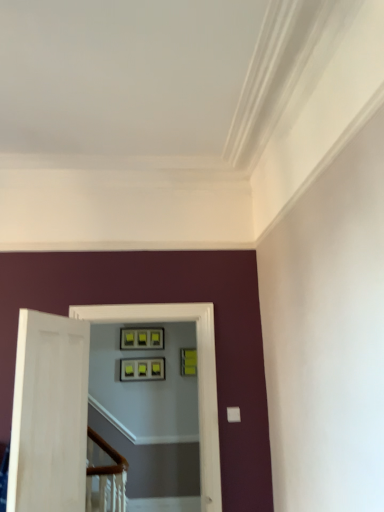
The width and height of the screenshot is (384, 512). In order to click on matte black picture frame at center, which is the 1th picture frame in left-to-right order in this screenshot , I will do `click(142, 369)`.

The width and height of the screenshot is (384, 512). What do you see at coordinates (198, 375) in the screenshot?
I see `matte black frames at center` at bounding box center [198, 375].

At what (x,y) coordinates should I click in order to perform the action: click on green matte picture frame at upper center, which is the 2th picture frame from left to right. Please return your answer as a coordinate pair (x, y). Image resolution: width=384 pixels, height=512 pixels. Looking at the image, I should click on (188, 362).

From the image's perspective, is green matte picture frame at upper center, which is the 2th picture frame from left to right, below matte black frames at center?

Indeed, from the image's perspective, green matte picture frame at upper center, which is the 2th picture frame from left to right, is shown beneath matte black frames at center.

This screenshot has width=384, height=512. In order to click on passage lying on the left of green matte picture frame at upper center, which is the 2th picture frame from left to right in this screenshot , I will do `click(198, 375)`.

Does point (182, 362) lie in front of point (75, 308)?

No, (182, 362) is behind (75, 308).

Is matte black picture frame at center, which is the second picture frame from right to left, far from matte black frames at center?

Yes, matte black picture frame at center, which is the second picture frame from right to left, and matte black frames at center are located far from each other.

From a real-world perspective, is matte black picture frame at center, which is the second picture frame from right to left, over matte black frames at center?

Yes, from a real-world perspective, matte black picture frame at center, which is the second picture frame from right to left, is over matte black frames at center

Is matte black picture frame at center, which is the second picture frame from right to left, in front of matte black frames at center?

No, the depth of matte black picture frame at center, which is the second picture frame from right to left, is greater than that of matte black frames at center.

Based on their sizes in the image, would you say matte black picture frame at center, which is the second picture frame from right to left, is bigger or smaller than matte black frames at center?

matte black picture frame at center, which is the second picture frame from right to left, is smaller than matte black frames at center.

Considering the relative sizes of matte black frames at center and green matte picture frame at upper center, the 1th picture frame positioned from the right, in the image provided, is matte black frames at center wider than green matte picture frame at upper center, the 1th picture frame positioned from the right,?

Yes, matte black frames at center is wider than green matte picture frame at upper center, the 1th picture frame positioned from the right.

Can you tell me how much matte black frames at center and green matte picture frame at upper center, which is the 2th picture frame from left to right, differ in facing direction?

The angular difference between matte black frames at center and green matte picture frame at upper center, which is the 2th picture frame from left to right, is 5.85 degrees.

Is green matte picture frame at upper center, the 1th picture frame positioned from the right, a part of matte black frames at center?

No.

The width and height of the screenshot is (384, 512). I want to click on passage below the green matte picture frame at upper center, the 1th picture frame positioned from the right (from a real-world perspective), so click(198, 375).

Which object is positioned more to the right, matte black frames at center or matte black picture frame at center, which is the second picture frame from right to left?

matte black frames at center is more to the right.

Looking at this image, is matte black frames at center next to matte black picture frame at center, which is the second picture frame from right to left?

No, matte black frames at center is not with matte black picture frame at center, which is the second picture frame from right to left.

Is point (203, 429) more distant than point (164, 378)?

No, it is not.

Where is `picture frame on the left of matte black frames at center`? picture frame on the left of matte black frames at center is located at coordinates (142, 369).

Considering the relative sizes of matte black picture frame at center, which is the second picture frame from right to left, and green matte picture frame at upper center, which is the 2th picture frame from left to right, in the image provided, is matte black picture frame at center, which is the second picture frame from right to left, bigger than green matte picture frame at upper center, which is the 2th picture frame from left to right,?

No.

Measure the distance between matte black picture frame at center, which is the 1th picture frame in left-to-right order, and green matte picture frame at upper center, which is the 2th picture frame from left to right.

They are 25.74 inches apart.

Which of these two, matte black picture frame at center, which is the 1th picture frame in left-to-right order, or green matte picture frame at upper center, the 1th picture frame positioned from the right, is thinner?

With smaller width is green matte picture frame at upper center, the 1th picture frame positioned from the right.

Based on the photo, considering the relative positions of matte black picture frame at center, which is the 1th picture frame in left-to-right order, and green matte picture frame at upper center, the 1th picture frame positioned from the right, in the image provided, is matte black picture frame at center, which is the 1th picture frame in left-to-right order, to the right of green matte picture frame at upper center, the 1th picture frame positioned from the right, from the viewer's perspective?

In fact, matte black picture frame at center, which is the 1th picture frame in left-to-right order, is to the left of green matte picture frame at upper center, the 1th picture frame positioned from the right.

Considering the relative positions of green matte picture frame at upper center, the 1th picture frame positioned from the right, and matte black picture frame at center, which is the second picture frame from right to left, in the image provided, is green matte picture frame at upper center, the 1th picture frame positioned from the right, in front of matte black picture frame at center, which is the second picture frame from right to left,?

No.

Is green matte picture frame at upper center, which is the 2th picture frame from left to right, bigger or smaller than matte black picture frame at center, which is the 1th picture frame in left-to-right order?

Clearly, green matte picture frame at upper center, which is the 2th picture frame from left to right, is larger in size than matte black picture frame at center, which is the 1th picture frame in left-to-right order.

From a real-world perspective, who is located higher, green matte picture frame at upper center, which is the 2th picture frame from left to right, or matte black picture frame at center, which is the 1th picture frame in left-to-right order?

In real-world perspective, green matte picture frame at upper center, which is the 2th picture frame from left to right, is above.

I want to click on passage that is in front of the green matte picture frame at upper center, the 1th picture frame positioned from the right, so click(x=198, y=375).

This screenshot has height=512, width=384. In order to click on passage above the matte black picture frame at center, which is the second picture frame from right to left (from the image's perspective) in this screenshot , I will do `click(198, 375)`.

Estimate the real-world distances between objects in this image. Which object is further from green matte picture frame at upper center, the 1th picture frame positioned from the right, matte black picture frame at center, which is the second picture frame from right to left, or matte black frames at center?

Based on the image, matte black frames at center appears to be further to green matte picture frame at upper center, the 1th picture frame positioned from the right.

From the image, which object appears to be farther from matte black frames at center, green matte picture frame at upper center, which is the 2th picture frame from left to right, or matte black picture frame at center, which is the 1th picture frame in left-to-right order?

Based on the image, green matte picture frame at upper center, which is the 2th picture frame from left to right, appears to be further to matte black frames at center.

Considering their positions, is matte black frames at center positioned closer to matte black picture frame at center, which is the second picture frame from right to left, than green matte picture frame at upper center, the 1th picture frame positioned from the right?

green matte picture frame at upper center, the 1th picture frame positioned from the right.

Which object lies further to the anchor point green matte picture frame at upper center, the 1th picture frame positioned from the right, matte black frames at center or matte black picture frame at center, which is the second picture frame from right to left?

matte black frames at center is positioned further to the anchor green matte picture frame at upper center, the 1th picture frame positioned from the right.

Considering their positions, is matte black picture frame at center, which is the 1th picture frame in left-to-right order, positioned further to matte black frames at center than green matte picture frame at upper center, which is the 2th picture frame from left to right?

Based on the image, green matte picture frame at upper center, which is the 2th picture frame from left to right, appears to be further to matte black frames at center.

From the image, which object appears to be farther from matte black picture frame at center, which is the second picture frame from right to left, green matte picture frame at upper center, which is the 2th picture frame from left to right, or matte black frames at center?

matte black frames at center is positioned further to the anchor matte black picture frame at center, which is the second picture frame from right to left.

In order to click on picture frame between matte black frames at center and green matte picture frame at upper center, the 1th picture frame positioned from the right, from front to back in this screenshot , I will do `click(142, 369)`.